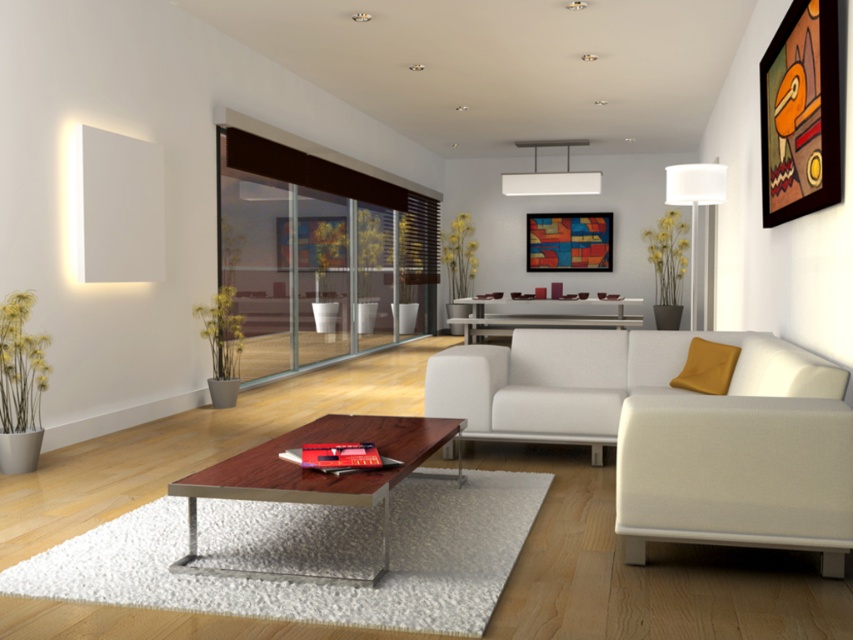
Question: Does transparent glass door at center have a greater width compared to multicolored painted frame at upper center?

Choices:
 (A) yes
 (B) no

Answer: (B)

Question: Is multicolored painted frame at upper center to the left of metallic silver console table at center from the viewer's perspective?

Choices:
 (A) no
 (B) yes

Answer: (B)

Question: Which object is farther from the camera taking this photo?

Choices:
 (A) white fabric couch at center
 (B) multicolored painted frame at upper center

Answer: (B)

Question: Estimate the real-world distances between objects in this image. Which object is farther from the metallic silver console table at center?

Choices:
 (A) wooden framed artwork at upper right
 (B) transparent glass door at center
 (C) wooden/metal coffee table at center

Answer: (C)

Question: Estimate the real-world distances between objects in this image. Which object is farther from the transparent glass door at center?

Choices:
 (A) wooden framed artwork at upper right
 (B) metallic silver console table at center

Answer: (A)

Question: From the image, what is the correct spatial relationship of white fabric couch at center in relation to transparent glass door at center?

Choices:
 (A) left
 (B) right

Answer: (B)